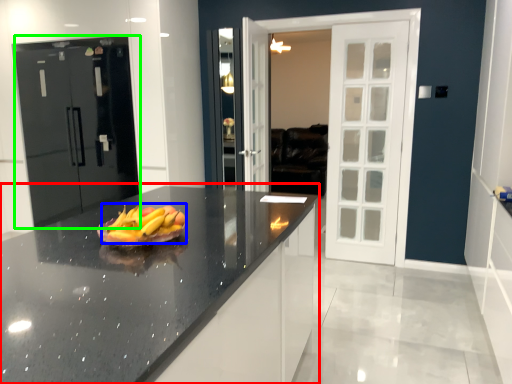
Question: Which is farther away from countertop (highlighted by a red box)? grapefruit (highlighted by a blue box) or door (highlighted by a green box)?

Choices:
 (A) grapefruit
 (B) door

Answer: (B)